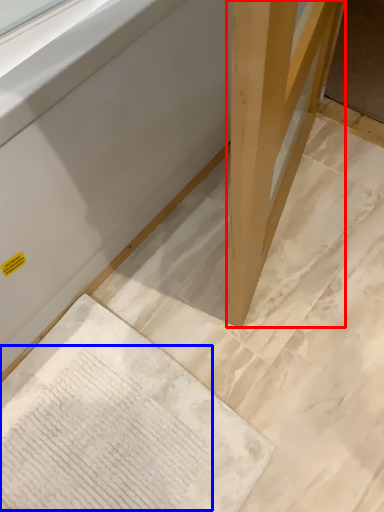
Question: Among these objects, which one is nearest to the camera, wood (highlighted by a red box) or writing (highlighted by a blue box)?

Choices:
 (A) wood
 (B) writing

Answer: (A)